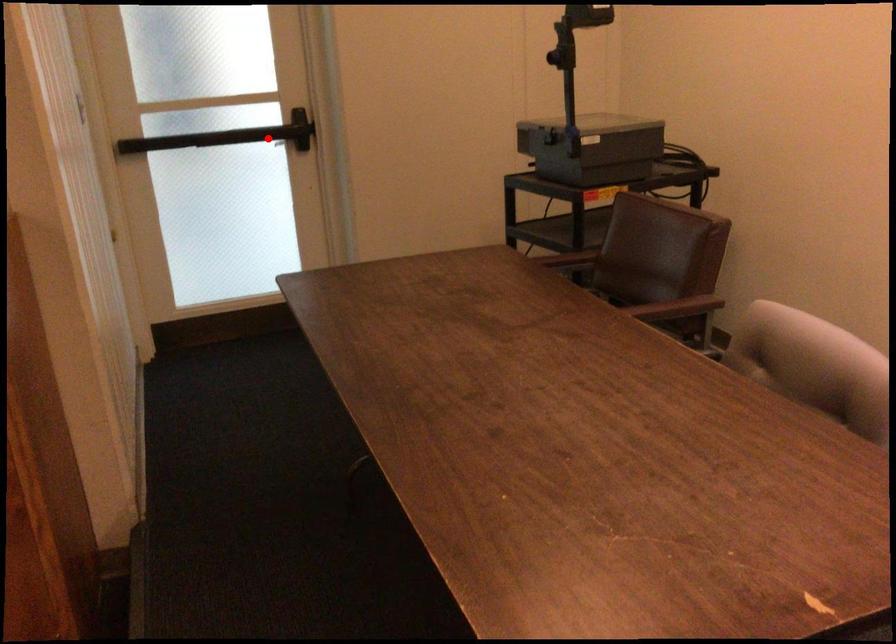
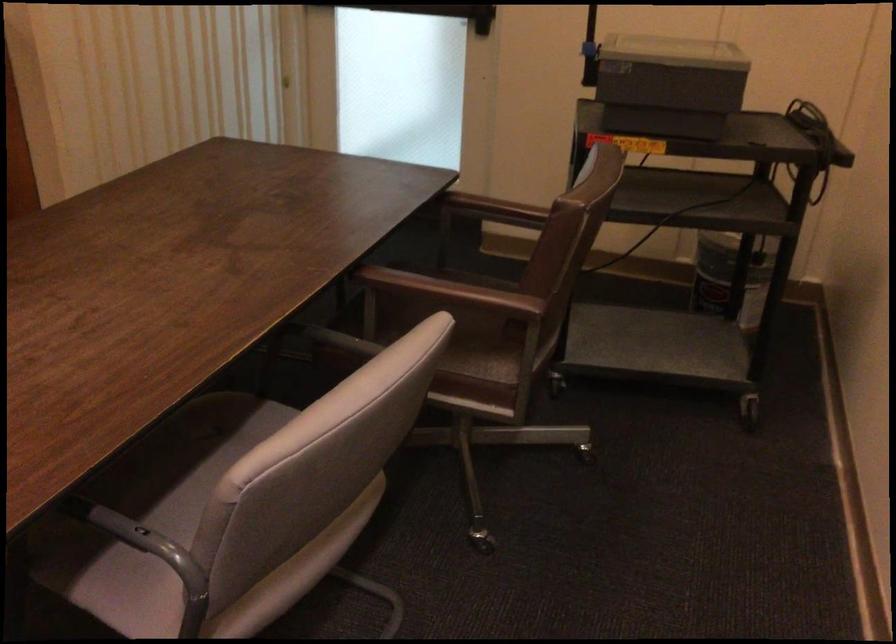
The point at the highlighted location is marked in the first image. Where is the corresponding point in the second image?

(437, 12)